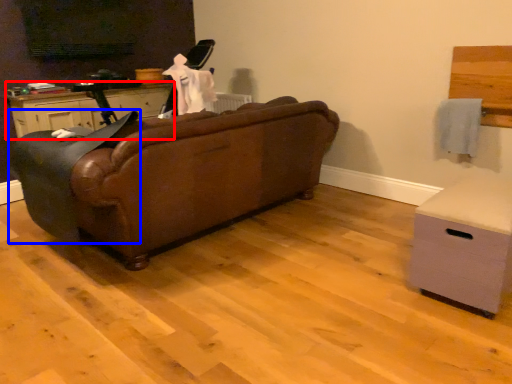
Question: Which of the following is the farthest to the observer, cabinetry (highlighted by a red box) or rocking chair (highlighted by a blue box)?

Choices:
 (A) cabinetry
 (B) rocking chair

Answer: (A)